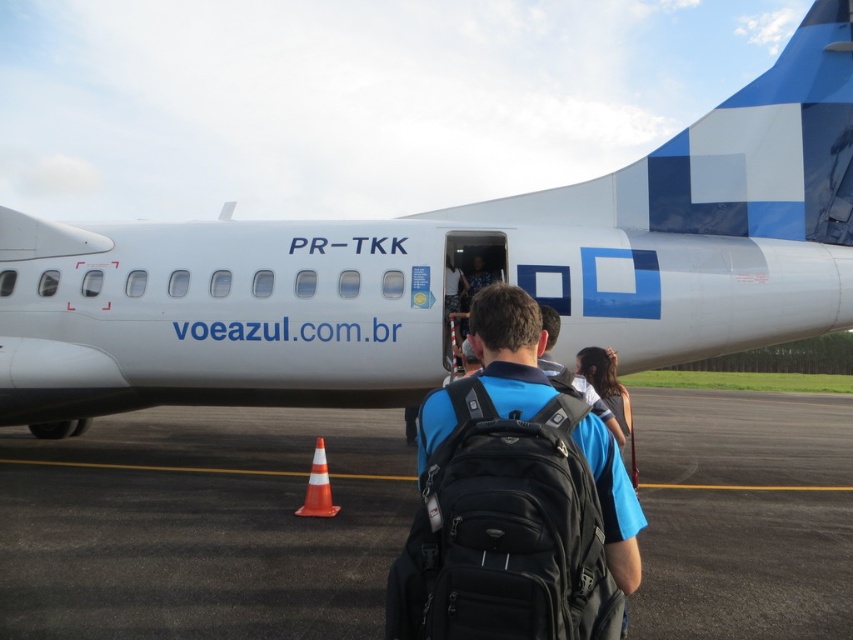
You are a pilot preparing to taxi the white matte airplane at center from the current position. The black asphalt at center is the runway. Since the airplane is on the left side of the runway, which direction should you turn to align with the runway centerline?

The white matte airplane at center is positioned on the left side of the black asphalt at center. To align with the runway centerline, you should turn to the right.

You are a delivery person who needs to place a large package on the ground between the black asphalt at center and the black matte backpack at center. Which object should you place the package next to to ensure it fits?

The black asphalt at center is wider than the black matte backpack at center, so placing the package next to the black asphalt at center will ensure it fits.

You are standing at point (22, 394) and want to walk to point (305, 413). Based on the scene description, is there any obstruction between these two points that might block your path?

Point (22, 394) is in front of point (305, 413), so there is no obstruction between them. You can walk directly to point (305, 413) without any issues.